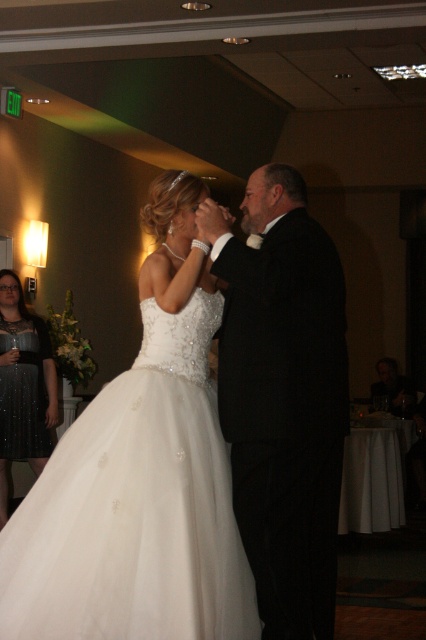
Question: Which object is closer to the camera taking this photo?

Choices:
 (A) black satin suit at center
 (B) white satin dress at center

Answer: (B)

Question: Which object appears farthest from the camera in this image?

Choices:
 (A) black satin suit at center
 (B) white satin dress at center
 (C) sparkly black dress at left

Answer: (C)

Question: Is white satin dress at center positioned before sparkly black dress at left?

Choices:
 (A) no
 (B) yes

Answer: (B)

Question: Can you confirm if black satin suit at center is smaller than sparkly black dress at left?

Choices:
 (A) no
 (B) yes

Answer: (A)

Question: Is the position of black satin suit at center more distant than that of sparkly black dress at left?

Choices:
 (A) no
 (B) yes

Answer: (A)

Question: Estimate the real-world distances between objects in this image. Which object is farther from the white satin dress at center?

Choices:
 (A) sparkly black dress at left
 (B) black satin suit at center

Answer: (A)